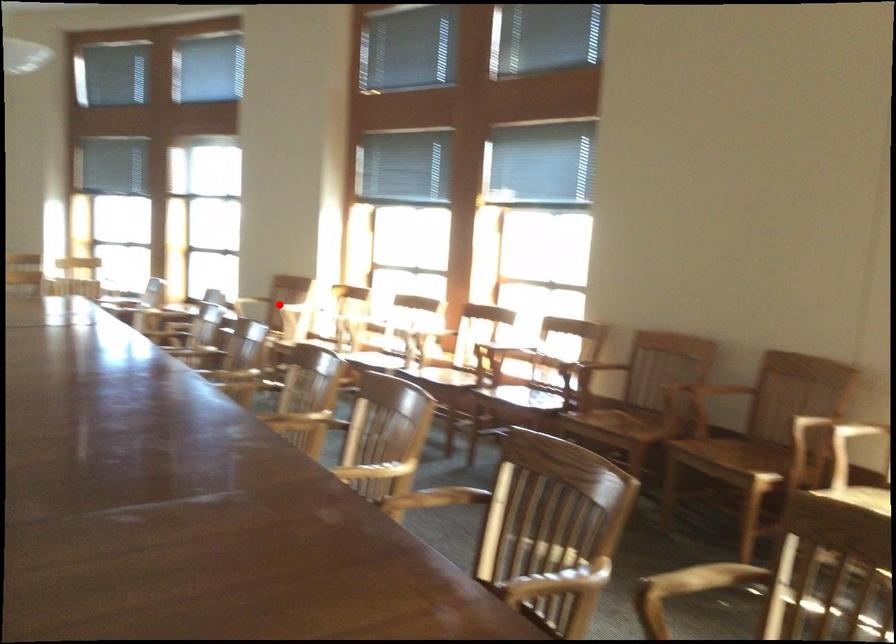
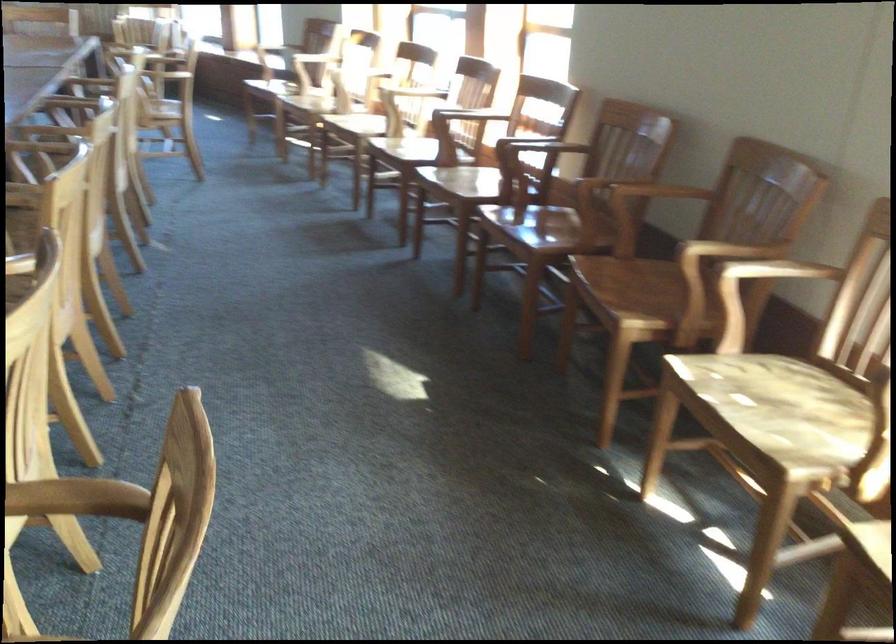
Question: I am providing you with two images of the same scene from different viewpoints. Given a red point in image1, look at the same physical point in image2. Is it:

Choices:
 (A) Closer to the viewpoint
 (B) Farther from the viewpoint

Answer: (A)